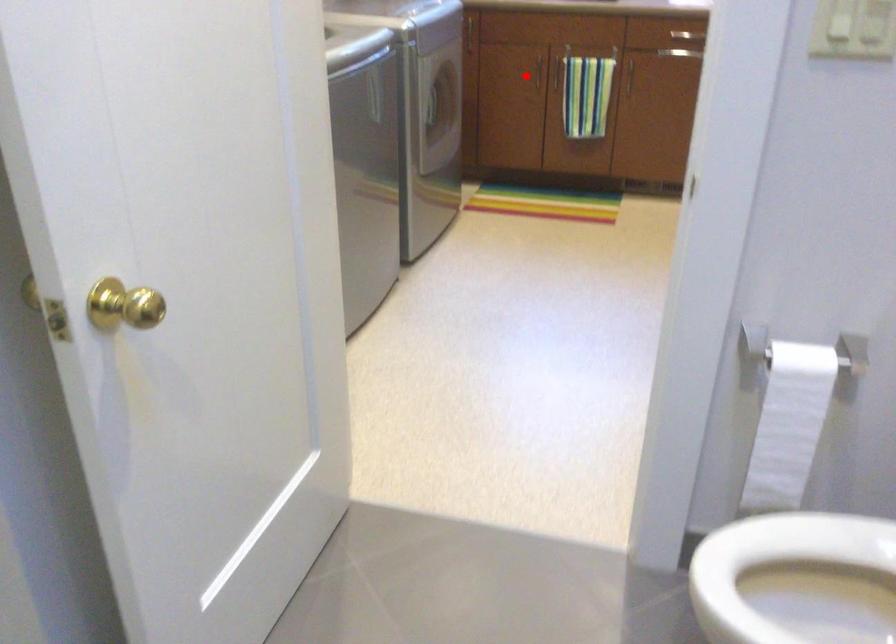
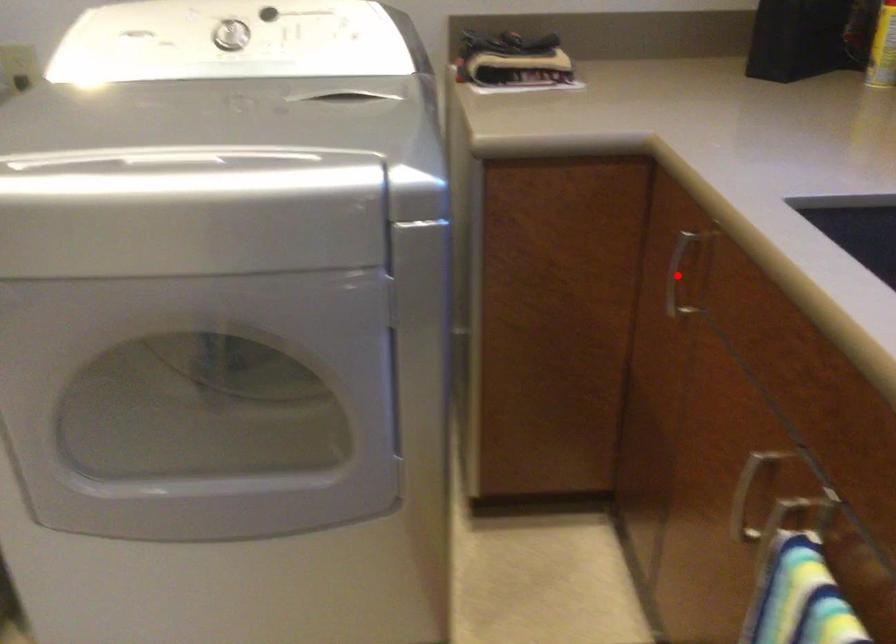
I am providing you with two images of the same scene from different viewpoints. A red point is marked on the first image and another point is marked on the second image. Does the point marked in image1 correspond to the same location as the one in image2?

No